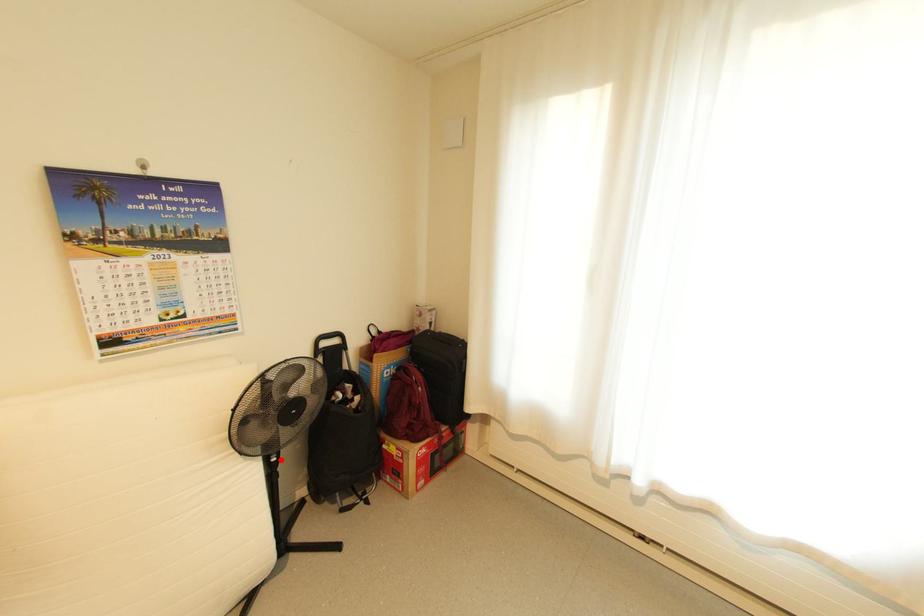
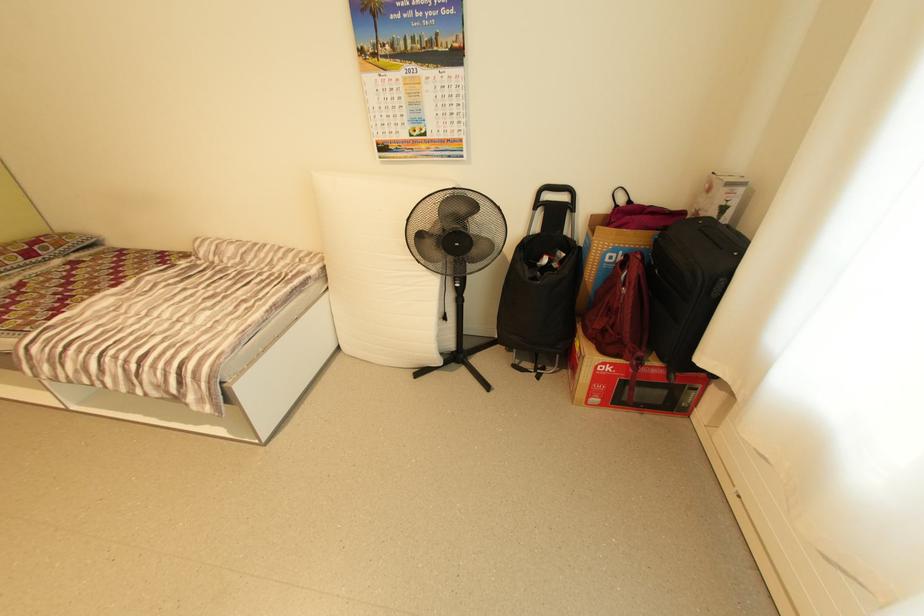
In the second image, find the point that corresponds to the highlighted location in the first image.

(464, 286)